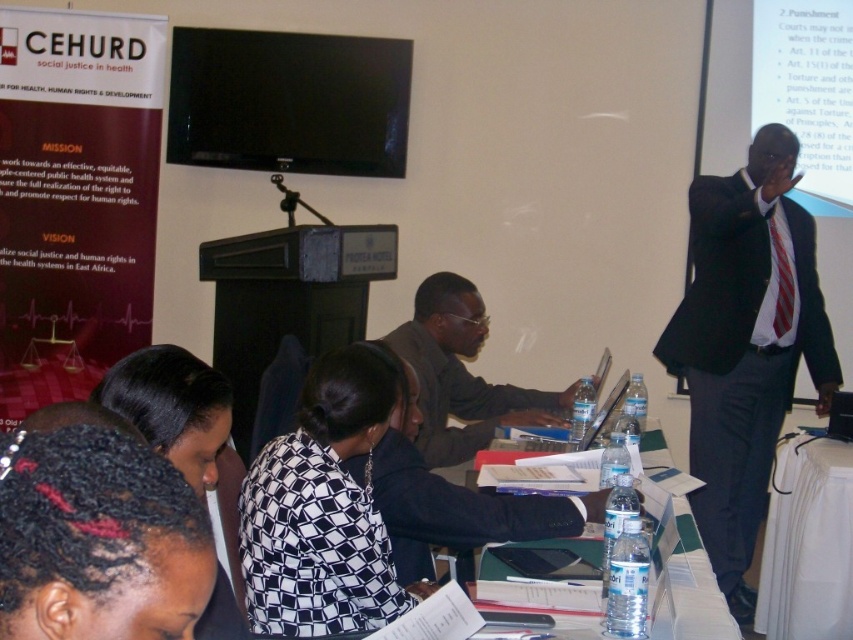
How distant is dark suit at right from clear plastic water bottles at lower center?

dark suit at right is 77.14 centimeters away from clear plastic water bottles at lower center.

Image resolution: width=853 pixels, height=640 pixels. Identify the location of dark suit at right. (746, 344).

Image resolution: width=853 pixels, height=640 pixels. Find the location of `dark suit at right`. dark suit at right is located at coordinates (746, 344).

Based on the photo, who is taller, dark suit at right or matte gray shirt at center?

dark suit at right is taller.

Who is more forward, (703, 525) or (463, 452)?

Point (463, 452) is in front.

Measure the distance between point (711, 460) and camera.

Point (711, 460) and camera are 3.34 meters apart from each other.

Where is `dark suit at right`? The width and height of the screenshot is (853, 640). dark suit at right is located at coordinates (746, 344).

Can you confirm if dark suit at right is shorter than white fabric table at lower right?

In fact, dark suit at right may be taller than white fabric table at lower right.

At what (x,y) coordinates should I click in order to perform the action: click on dark suit at right. Please return your answer as a coordinate pair (x, y). The width and height of the screenshot is (853, 640). Looking at the image, I should click on (746, 344).

Is point (711, 180) positioned before point (840, 529)?

That is False.

Where is `dark suit at right`? dark suit at right is located at coordinates (746, 344).